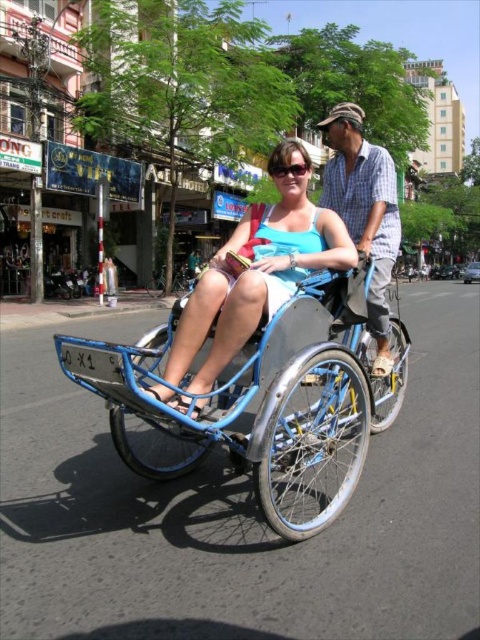
Question: Which is farther from the blue plaid shirt at center?

Choices:
 (A) clear plastic goggles at center
 (B) matte blue wheelchair at center

Answer: (B)

Question: Does blue metallic tricycle at center appear under clear plastic goggles at center?

Choices:
 (A) yes
 (B) no

Answer: (A)

Question: Is blue metallic tricycle at center bigger than matte blue wheelchair at center?

Choices:
 (A) no
 (B) yes

Answer: (B)

Question: Among these objects, which one is nearest to the camera?

Choices:
 (A) clear plastic goggles at center
 (B) blue metallic tricycle at center

Answer: (B)

Question: Is blue metallic tricycle at center bigger than blue plaid shirt at center?

Choices:
 (A) yes
 (B) no

Answer: (B)

Question: Which object is the farthest from the blue plaid shirt at center?

Choices:
 (A) matte blue wheelchair at center
 (B) blue metallic tricycle at center
 (C) clear plastic goggles at center

Answer: (A)